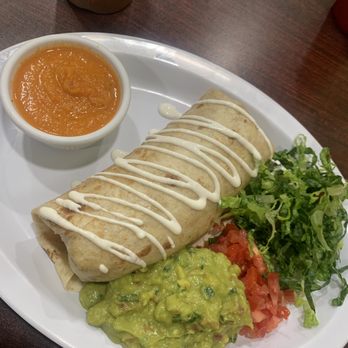
Identify the location of wooden tabletop. This screenshot has width=348, height=348. (318, 119).